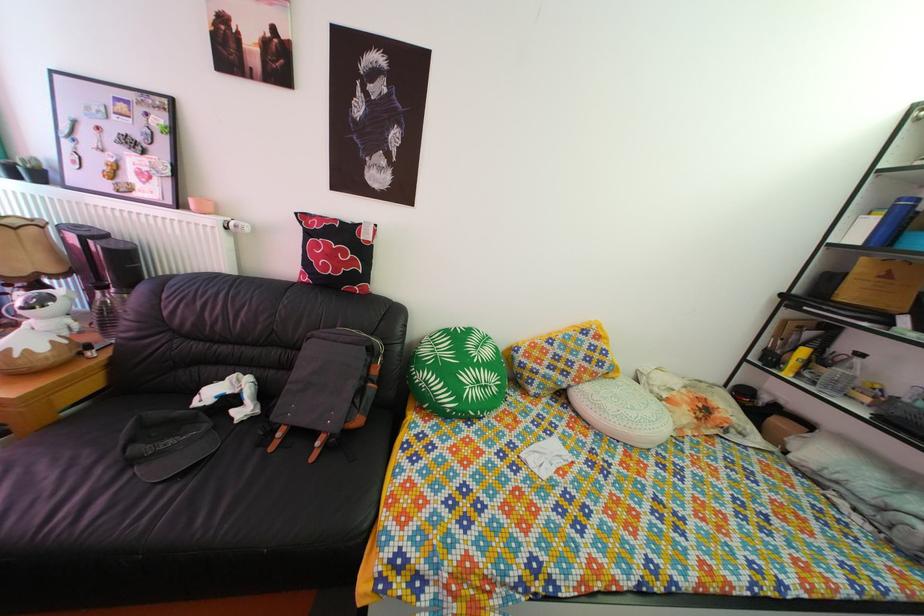
Find where to lift the yellow patterned pillow. Please return your answer as a coordinate pair (x, y).

(562, 359)